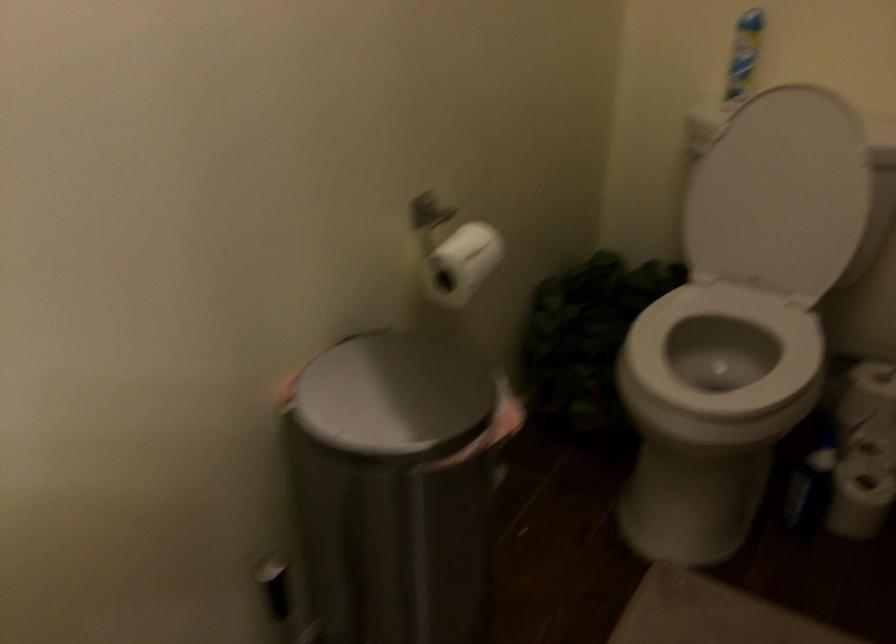
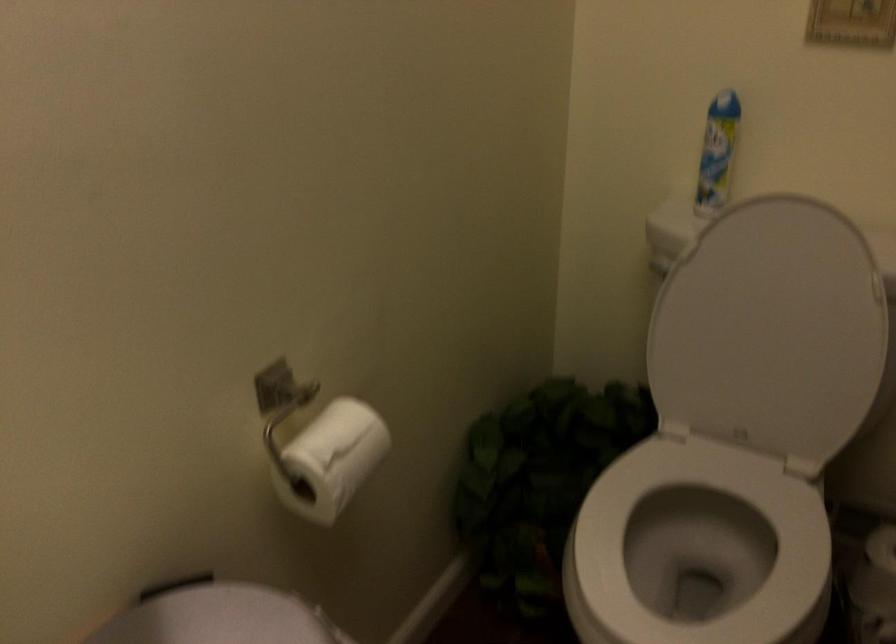
Locate, in the second image, the point that corresponds to pixel 720 373 in the first image.

(698, 547)